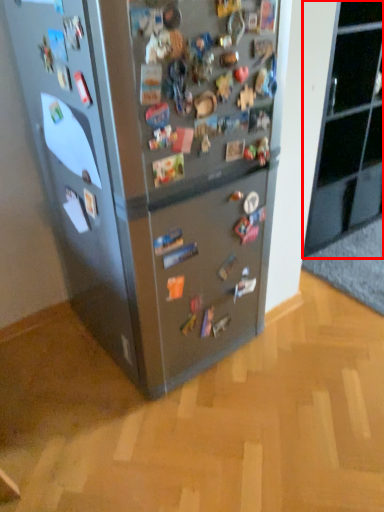
Question: From the image's perspective, what is the correct spatial positioning of cabinetry (annotated by the red box) in reference to refrigerator?

Choices:
 (A) below
 (B) above

Answer: (B)